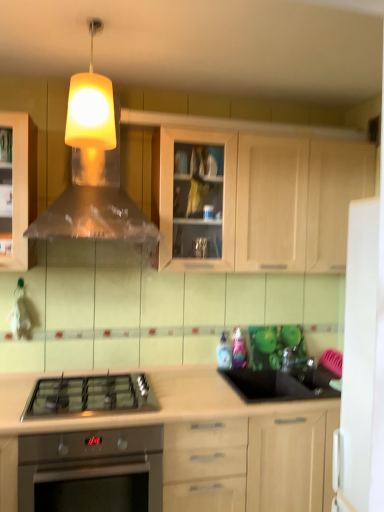
The height and width of the screenshot is (512, 384). In order to click on free region under metallic silver vent at upper center (from a real-world perspective) in this screenshot , I will do `click(96, 380)`.